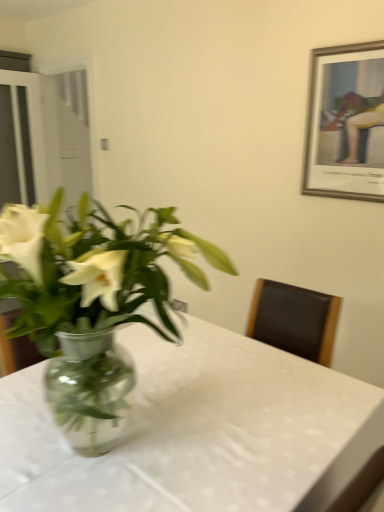
Question: Choose the correct answer: Is clear glass vase at center inside silver/golden frame at upper right or outside it?

Choices:
 (A) inside
 (B) outside

Answer: (B)

Question: From the image's perspective, is clear glass vase at center above or below silver/golden frame at upper right?

Choices:
 (A) above
 (B) below

Answer: (B)

Question: Based on their relative distances, which object is farther from the clear glass vase at center?

Choices:
 (A) silver/golden frame at upper right
 (B) transparent glass door at left, which is the first glass door from right to left
 (C) transparent glass table at center
 (D) transparent glass door at left, the second glass door viewed from the right

Answer: (D)

Question: Which object is the farthest from the silver/golden frame at upper right?

Choices:
 (A) transparent glass table at center
 (B) clear glass vase at center
 (C) transparent glass door at left, the second glass door viewed from the right
 (D) transparent glass door at left, which is the second glass door in left-to-right order

Answer: (C)